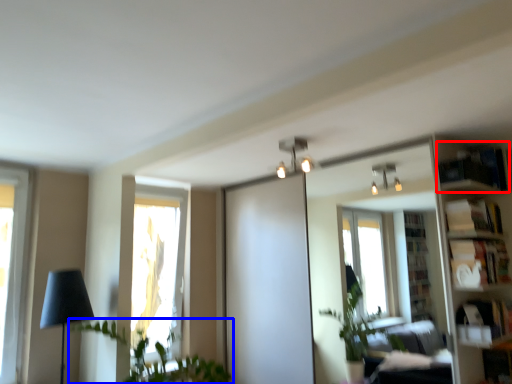
Question: Which of the following is the farthest to the observer, shelf (highlighted by a red box) or houseplant (highlighted by a blue box)?

Choices:
 (A) shelf
 (B) houseplant

Answer: (A)